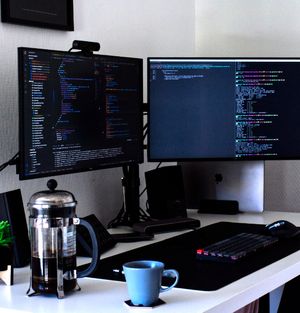
Where is `desk`? This screenshot has width=300, height=313. desk is located at coordinates (258, 218).